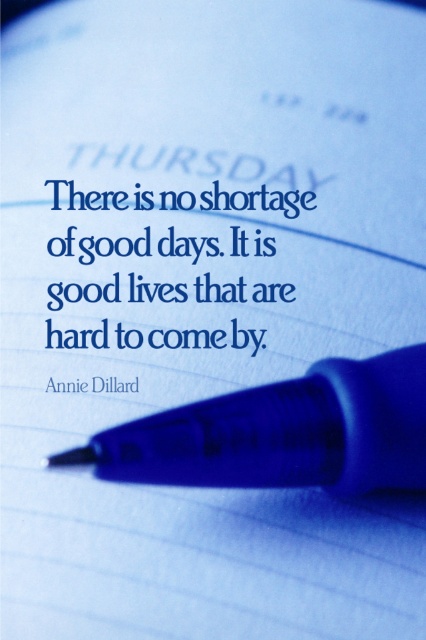
Is the position of blue paper at center less distant than that of blue plastic pen at center?

No, it is behind blue plastic pen at center.

Is blue paper at center below blue plastic pen at center?

Incorrect, blue paper at center is not positioned below blue plastic pen at center.

Identify the location of blue paper at center. Image resolution: width=426 pixels, height=640 pixels. (167, 266).

You are a GUI agent. You are given a task and a screenshot of the screen. Output one action in this format:
    pyautogui.click(x=<x>, y=<y>)
    Task: Click on the blue paper at center
    Image resolution: width=426 pixels, height=640 pixels.
    Given the screenshot: What is the action you would take?
    pyautogui.click(x=167, y=266)